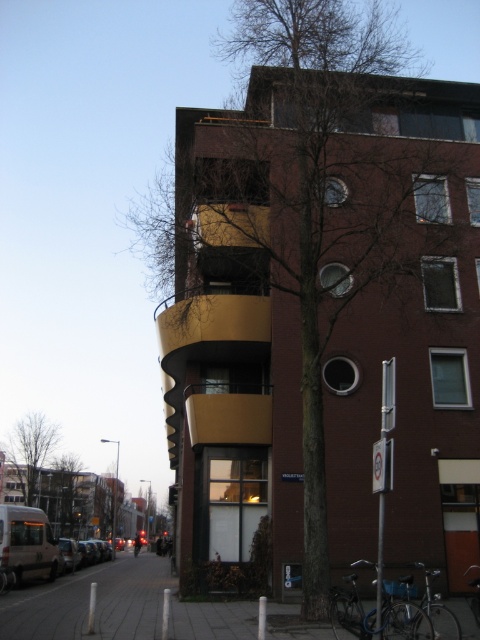
Question: Based on their relative distances, which object is nearer to the green leafy tree at center?

Choices:
 (A) gray concrete sidewalk at lower left
 (B) bare branches at left
 (C) brown textured tree at center

Answer: (B)

Question: Does brown textured tree at center appear under bare branches at left?

Choices:
 (A) no
 (B) yes

Answer: (A)

Question: Which object is the closest to the green leafy tree at center?

Choices:
 (A) brown textured tree at center
 (B) bare branches at left

Answer: (B)

Question: Can you confirm if bare branches at left is wider than green leafy tree at center?

Choices:
 (A) yes
 (B) no

Answer: (A)

Question: Is gray concrete sidewalk at lower left further to the viewer compared to bare branches at left?

Choices:
 (A) no
 (B) yes

Answer: (A)

Question: Among these points, which one is farthest from the camera?

Choices:
 (A) (319, 116)
 (B) (61, 528)

Answer: (B)